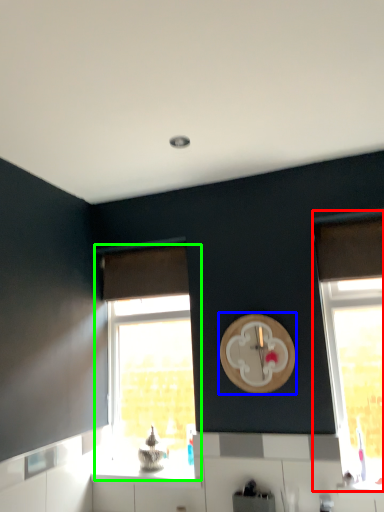
Question: Estimate the real-world distances between objects in this image. Which object is closer to window (highlighted by a red box), clock (highlighted by a blue box) or window (highlighted by a green box)?

Choices:
 (A) clock
 (B) window

Answer: (A)